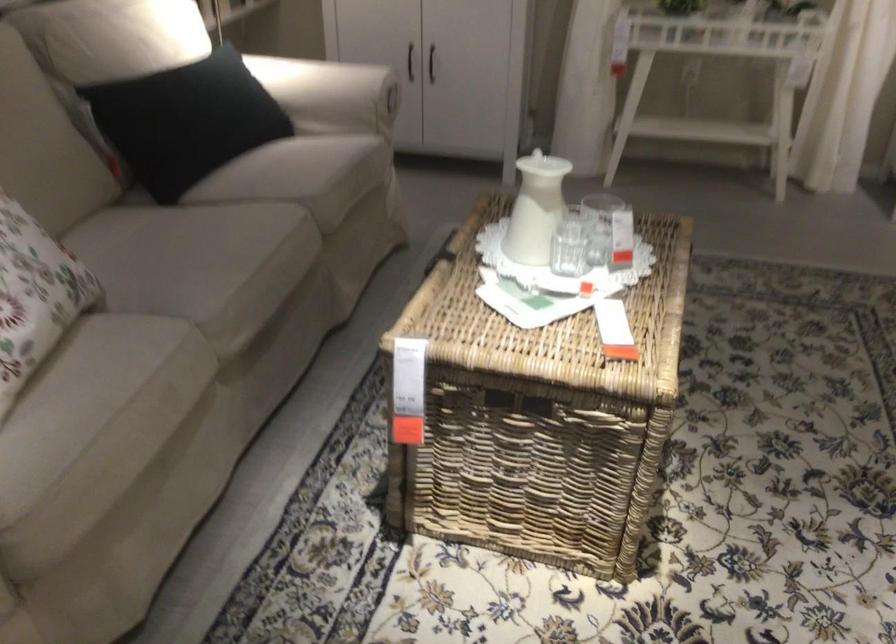
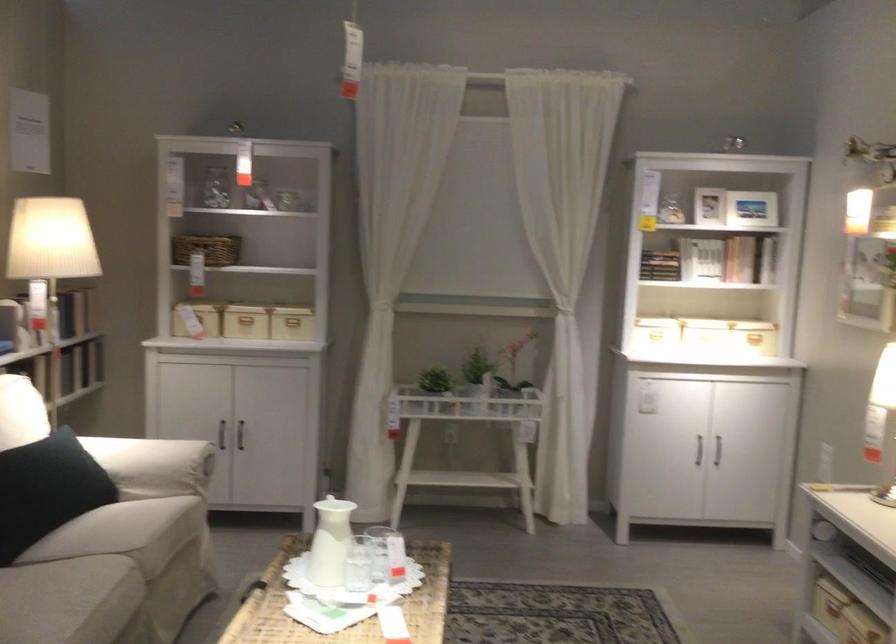
The point at [599,220] is marked in the first image. Where is the corresponding point in the second image?

(386, 554)